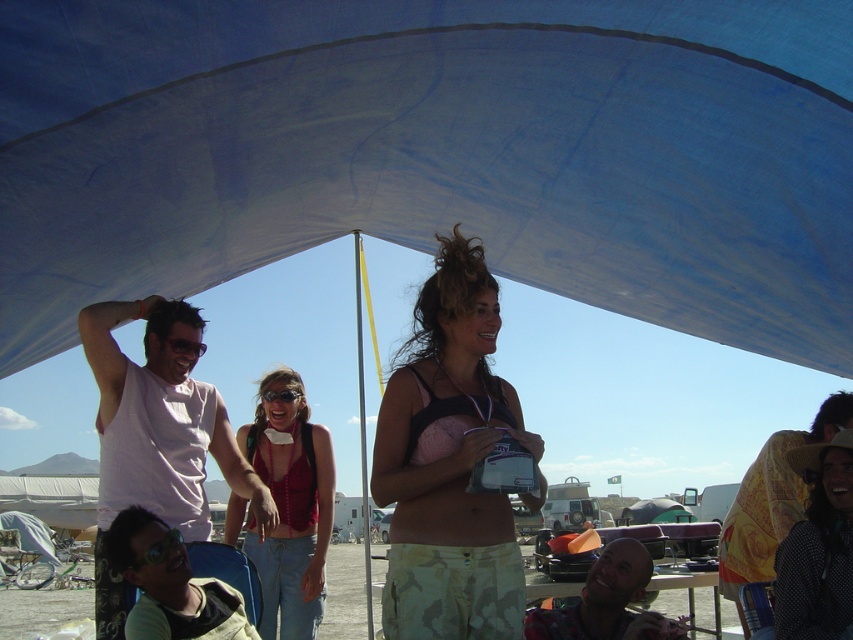
You are standing at the point marked as point (434, 154) in the image. What object is directly above you?

The blue fabric canopy at upper center is located at point (434, 154), so the object directly above you is the blue fabric canopy at upper center.

In the scene shown: You are a photographer trying to capture the denim jeans at center in your shot. Given that your camera has a focal length of 50mm and you are standing at point A, which is 3 meters away from the jeans, can you estimate the approximate size of the jeans in millimeters on your camera sensor?

The position of denim jeans at center is at point (289, 508), so the exact size cannot be determined without additional information about the sensor size or the distance from the jeans to the camera.

You are a photographer at the event and want to take a photo that includes both the polka dot fabric hat at lower right and the black plastic goggles at center. Which object should you focus on first to ensure both are in the frame?

The polka dot fabric hat at lower right is located below the black plastic goggles at center, so you should focus on the black plastic goggles at center first to ensure both are in the frame.